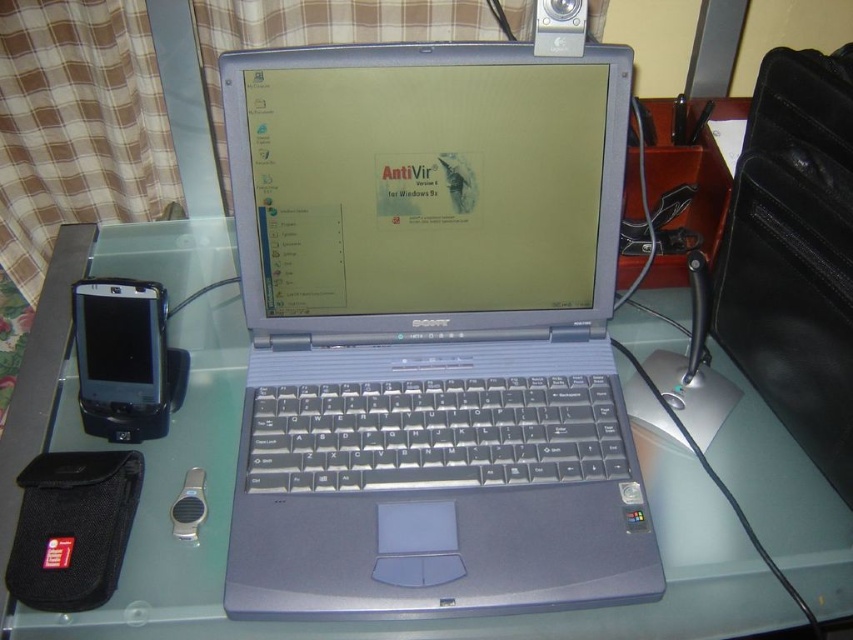
Question: Is silver metallic laptop at center above clear glass table at center?

Choices:
 (A) no
 (B) yes

Answer: (B)

Question: Can you confirm if silver metallic laptop at center is positioned to the left of clear glass table at center?

Choices:
 (A) yes
 (B) no

Answer: (B)

Question: Can you confirm if silver metallic laptop at center is thinner than clear glass table at center?

Choices:
 (A) no
 (B) yes

Answer: (B)